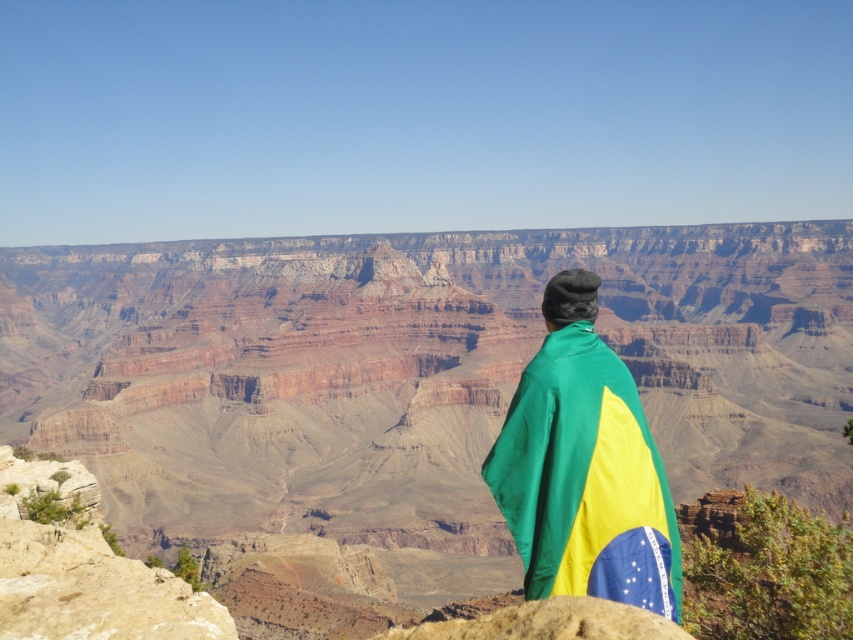
Question: Which of the following is the farthest from the observer?

Choices:
 (A) (618, 364)
 (B) (683, 385)

Answer: (B)

Question: Does brown rocky canyon at center have a greater width compared to green/yellow fabric draped at center?

Choices:
 (A) yes
 (B) no

Answer: (A)

Question: Considering the relative positions of brown rocky canyon at center and green/yellow fabric draped at center in the image provided, where is brown rocky canyon at center located with respect to green/yellow fabric draped at center?

Choices:
 (A) right
 (B) left

Answer: (A)

Question: From the image, what is the correct spatial relationship of brown rocky canyon at center in relation to green/yellow fabric draped at center?

Choices:
 (A) below
 (B) above

Answer: (B)